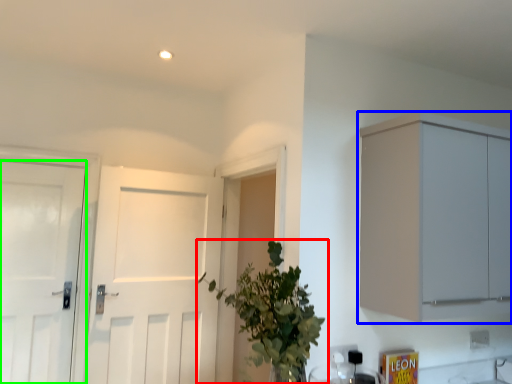
Question: Which object is the farthest from houseplant (highlighted by a red box)? Choose among these: cabinetry (highlighted by a blue box) or door (highlighted by a green box).

Choices:
 (A) cabinetry
 (B) door

Answer: (B)